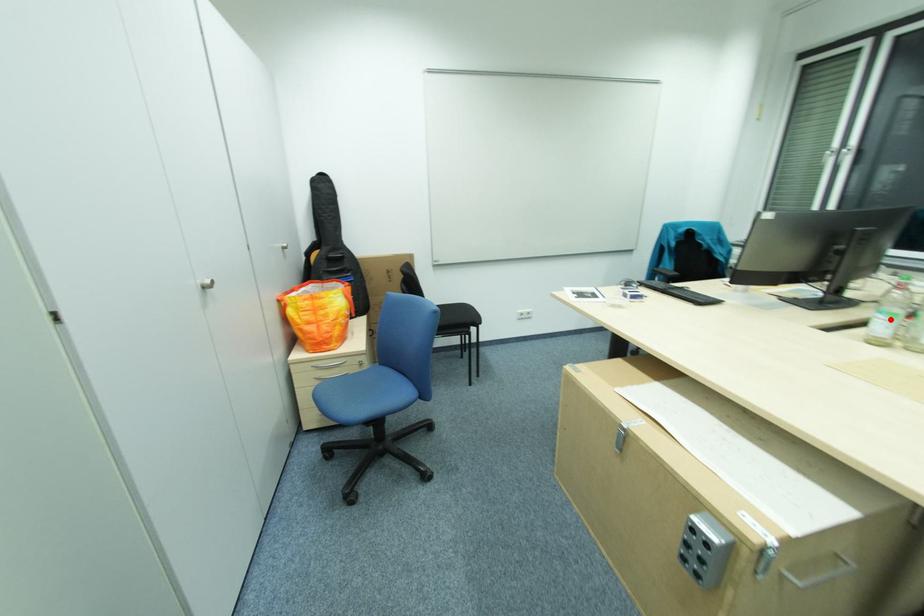
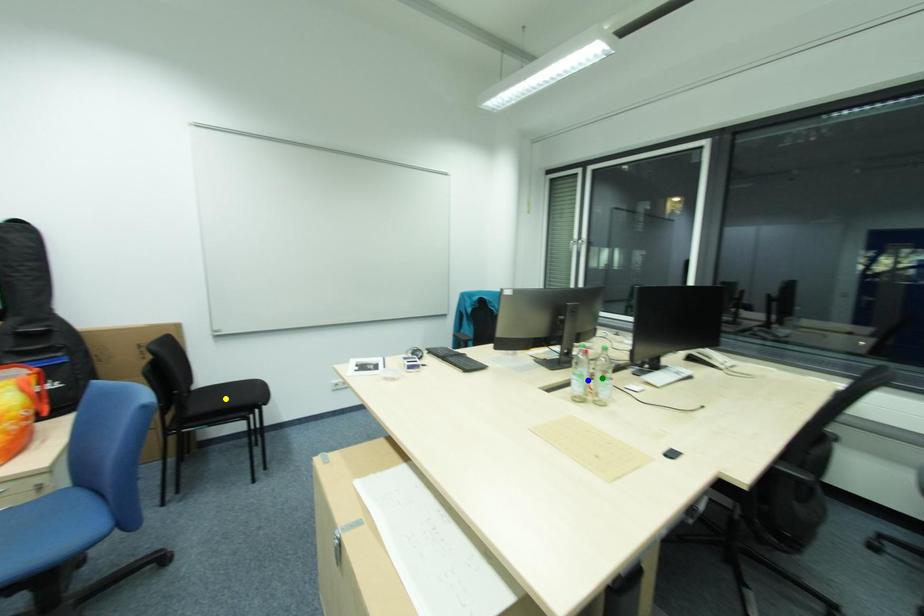
Question: I am providing you with two images of the same scene from different viewpoints. A red point is marked on the first image. You are given multiple points on the second image. In image 2, which mark is for the same physical point as the one in image 1?

Choices:
 (A) blue point
 (B) green point
 (C) yellow point

Answer: (A)